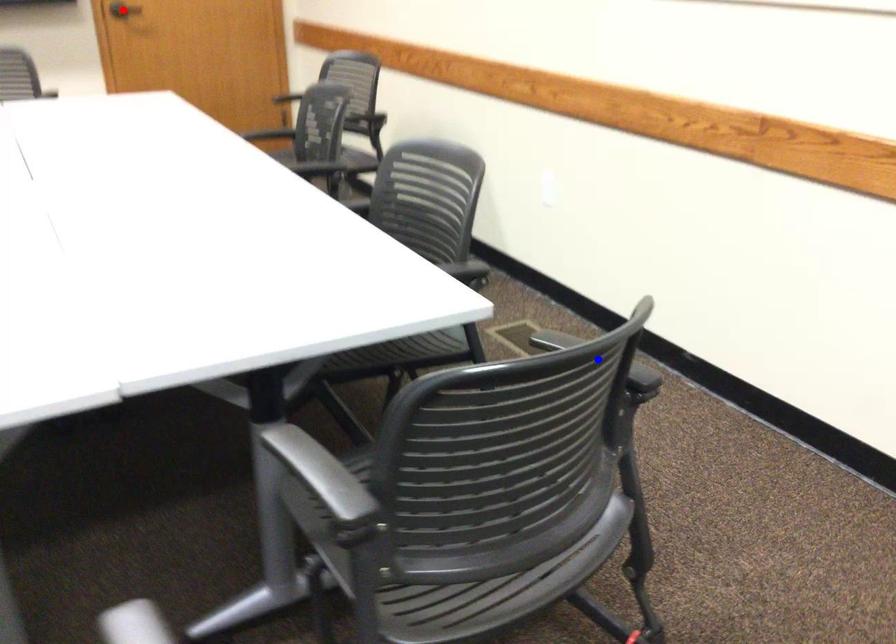
Question: Two points are marked on the image. Which point is closer to the camera?

Choices:
 (A) Blue point is closer.
 (B) Red point is closer.

Answer: (A)